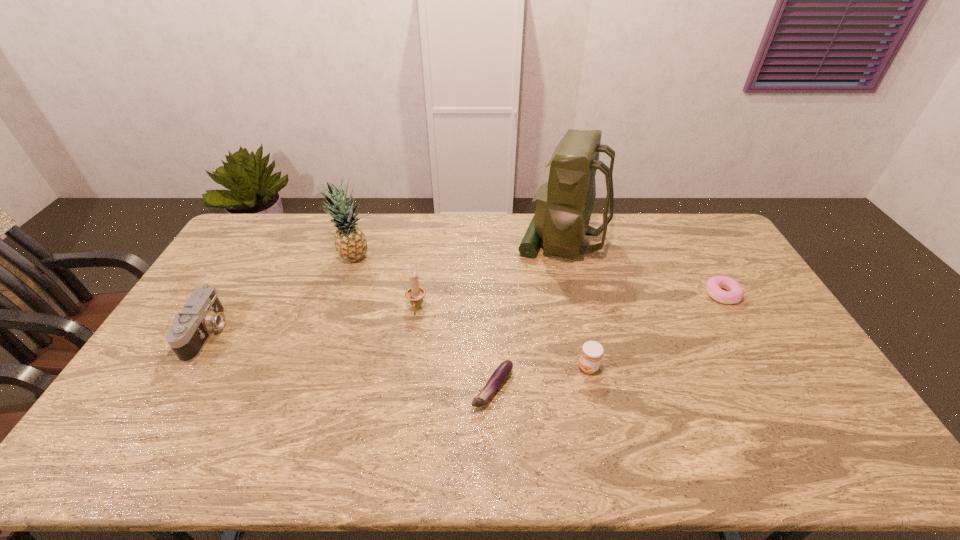
Where is `the tallest object`? the tallest object is located at coordinates (564, 206).

Locate an element on the screen. The height and width of the screenshot is (540, 960). the sixth object from right to left is located at coordinates (350, 242).

The image size is (960, 540). Identify the location of the sixth shortest object. (350, 242).

Locate an element on the screen. the third tallest object is located at coordinates (415, 293).

The image size is (960, 540). Identify the location of candle_holder. 415,293.

At what (x,y) coordinates should I click in order to perform the action: click on the fourth tallest object. Please return your answer as a coordinate pair (x, y). This screenshot has width=960, height=540. Looking at the image, I should click on (203, 312).

What are the coordinates of `the leftmost object` in the screenshot? It's located at (203, 312).

Where is `the third shortest object`? Image resolution: width=960 pixels, height=540 pixels. the third shortest object is located at coordinates (591, 355).

The height and width of the screenshot is (540, 960). Identify the location of pastry. (714, 284).

Locate an element on the screen. This screenshot has height=540, width=960. eggplant is located at coordinates (501, 373).